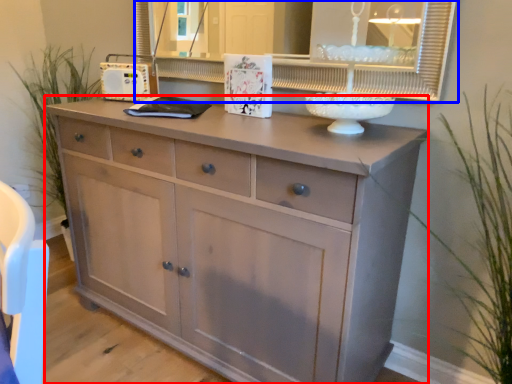
Question: Which object is further to the camera taking this photo, chest of drawers (highlighted by a red box) or medicine cabinet (highlighted by a blue box)?

Choices:
 (A) chest of drawers
 (B) medicine cabinet

Answer: (B)